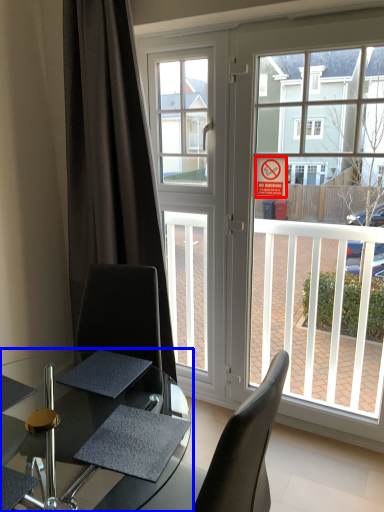
Question: Which object appears farthest to the camera in this image, parking sign (highlighted by a red box) or table (highlighted by a blue box)?

Choices:
 (A) parking sign
 (B) table

Answer: (A)